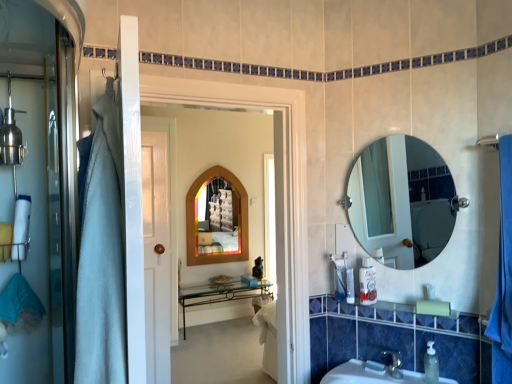
Question: Should I look upward or downward to see white fabric towel at left?

Choices:
 (A) down
 (B) up

Answer: (A)

Question: From the image's perspective, is white plastic container at right, the 3th toiletry positioned from the bottom, below wooden-framed mirror at center, the 1th mirror from the left?

Choices:
 (A) yes
 (B) no

Answer: (A)

Question: Is white plastic container at right, which appears as the 2th toiletry when viewed from the left, not inside wooden-framed mirror at center, the second mirror viewed from the front?

Choices:
 (A) no
 (B) yes

Answer: (B)

Question: Considering the relative sizes of white plastic container at right, marked as the second toiletry in a right-to-left arrangement, and wooden-framed mirror at center, the 1th mirror from the left, in the image provided, is white plastic container at right, marked as the second toiletry in a right-to-left arrangement, wider than wooden-framed mirror at center, the 1th mirror from the left,?

Choices:
 (A) no
 (B) yes

Answer: (B)

Question: Is white plastic container at right, marked as the second toiletry in a right-to-left arrangement, at the right side of wooden-framed mirror at center, which appears as the 2th mirror when viewed from the right?

Choices:
 (A) no
 (B) yes

Answer: (B)

Question: Does white plastic container at right, the 3th toiletry positioned from the bottom, have a smaller size compared to wooden-framed mirror at center, the second mirror viewed from the front?

Choices:
 (A) yes
 (B) no

Answer: (A)

Question: Does white plastic container at right, the 3th toiletry positioned from the bottom, have a lesser width compared to wooden-framed mirror at center, which appears as the 2th mirror when viewed from the right?

Choices:
 (A) yes
 (B) no

Answer: (B)

Question: Is wooden mirror at center to the left of translucent plastic soap dispenser at lower right, placed as the second toiletry when sorted from bottom to top, from the viewer's perspective?

Choices:
 (A) no
 (B) yes

Answer: (B)

Question: Is wooden mirror at center not near translucent plastic soap dispenser at lower right, the 2th toiletry viewed from the top?

Choices:
 (A) yes
 (B) no

Answer: (B)

Question: From the image's perspective, is wooden mirror at center under translucent plastic soap dispenser at lower right, acting as the first toiletry starting from the left?

Choices:
 (A) no
 (B) yes

Answer: (A)

Question: From a real-world perspective, does wooden mirror at center sit lower than translucent plastic soap dispenser at lower right, placed as the second toiletry when sorted from bottom to top?

Choices:
 (A) no
 (B) yes

Answer: (A)

Question: Considering the relative sizes of wooden mirror at center and translucent plastic soap dispenser at lower right, placed as the second toiletry when sorted from bottom to top, in the image provided, is wooden mirror at center bigger than translucent plastic soap dispenser at lower right, placed as the second toiletry when sorted from bottom to top,?

Choices:
 (A) yes
 (B) no

Answer: (A)

Question: From the image's perspective, does wooden mirror at center appear higher than translucent plastic soap dispenser at lower right, the third toiletry positioned from the front?

Choices:
 (A) no
 (B) yes

Answer: (B)

Question: From a real-world perspective, is white fabric towel at left over white plastic container at right, which appears as the 2th toiletry when viewed from the left?

Choices:
 (A) no
 (B) yes

Answer: (B)